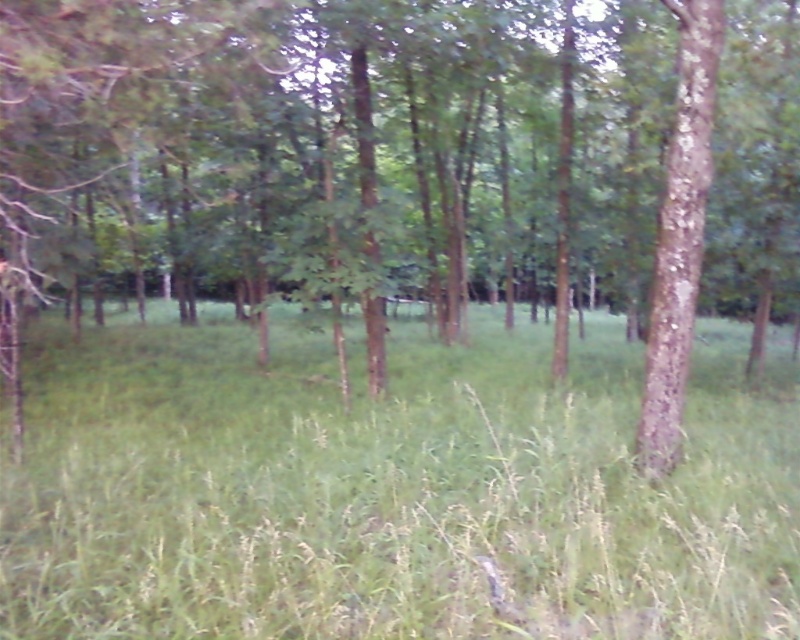
Question: Is the position of green grassy at center more distant than that of brown rough bark tree at right?

Choices:
 (A) no
 (B) yes

Answer: (A)

Question: Which of the following is the closest to the observer?

Choices:
 (A) brown rough bark tree at right
 (B) green grassy at center

Answer: (B)

Question: Is green grassy at center above brown rough bark tree at right?

Choices:
 (A) no
 (B) yes

Answer: (A)

Question: Which point is farther to the camera?

Choices:
 (A) (401, 408)
 (B) (672, 145)

Answer: (A)

Question: Does green grassy at center appear on the left side of brown rough bark tree at right?

Choices:
 (A) yes
 (B) no

Answer: (A)

Question: Which object appears farthest from the camera in this image?

Choices:
 (A) green grassy at center
 (B) brown rough bark tree at right

Answer: (B)